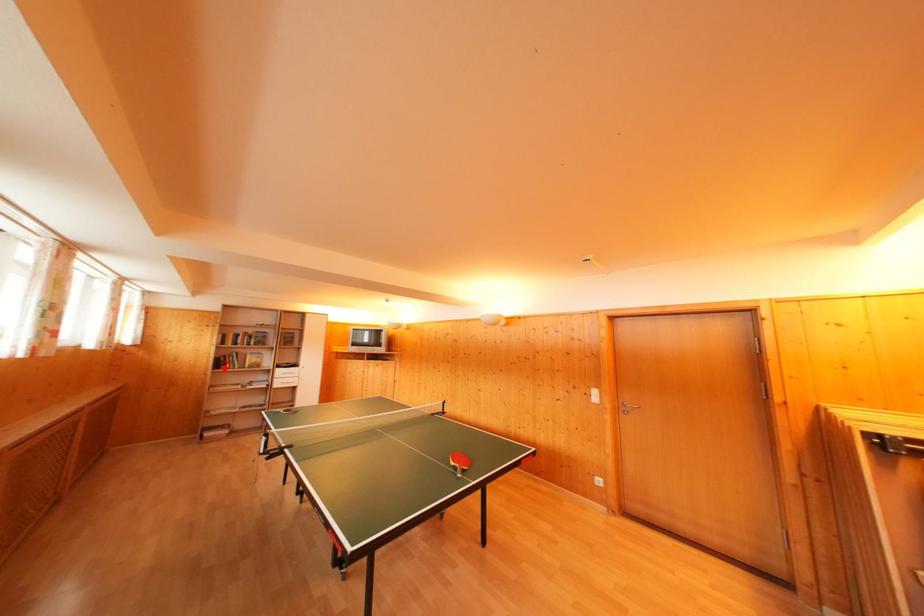
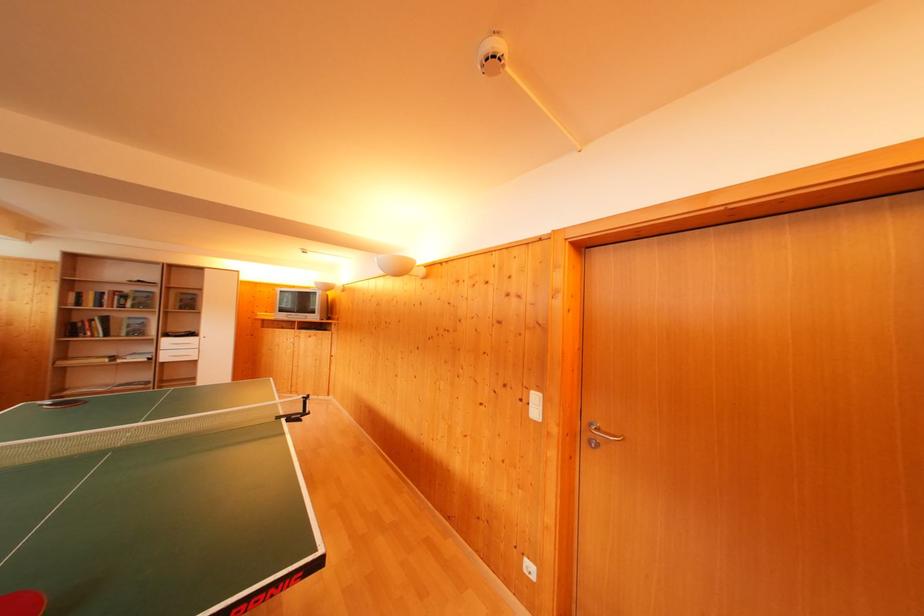
Where in the second image is the point corresponding to the highlighted location from the first image?

(76, 334)